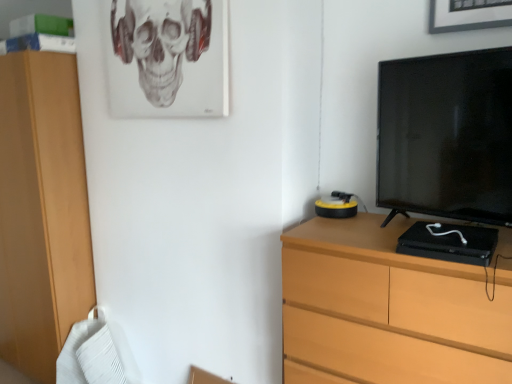
Question: From a real-world perspective, is black glossy television at right on wooden chest of drawers at right?

Choices:
 (A) no
 (B) yes

Answer: (B)

Question: Is black glossy television at right oriented away from wooden chest of drawers at right?

Choices:
 (A) no
 (B) yes

Answer: (A)

Question: Is black glossy television at right next to wooden chest of drawers at right and touching it?

Choices:
 (A) no
 (B) yes

Answer: (A)

Question: Does black glossy television at right turn towards wooden chest of drawers at right?

Choices:
 (A) yes
 (B) no

Answer: (B)

Question: From the image's perspective, is black glossy television at right on wooden chest of drawers at right?

Choices:
 (A) yes
 (B) no

Answer: (A)

Question: Considering the relative positions of black glossy television at right and wooden chest of drawers at right in the image provided, is black glossy television at right to the right of wooden chest of drawers at right from the viewer's perspective?

Choices:
 (A) yes
 (B) no

Answer: (A)

Question: Considering the relative sizes of black glossy television at right and gray matte skull at upper center in the image provided, is black glossy television at right smaller than gray matte skull at upper center?

Choices:
 (A) no
 (B) yes

Answer: (A)

Question: Would you say black glossy television at right is outside gray matte skull at upper center?

Choices:
 (A) yes
 (B) no

Answer: (A)

Question: Is black glossy television at right with gray matte skull at upper center?

Choices:
 (A) no
 (B) yes

Answer: (A)

Question: Is black glossy television at right far from gray matte skull at upper center?

Choices:
 (A) yes
 (B) no

Answer: (A)

Question: Does black glossy television at right have a greater width compared to gray matte skull at upper center?

Choices:
 (A) yes
 (B) no

Answer: (A)

Question: Does black glossy television at right lie behind gray matte skull at upper center?

Choices:
 (A) no
 (B) yes

Answer: (A)

Question: Does wooden chest of drawers at right have a lesser height compared to black glossy television at right?

Choices:
 (A) yes
 (B) no

Answer: (B)